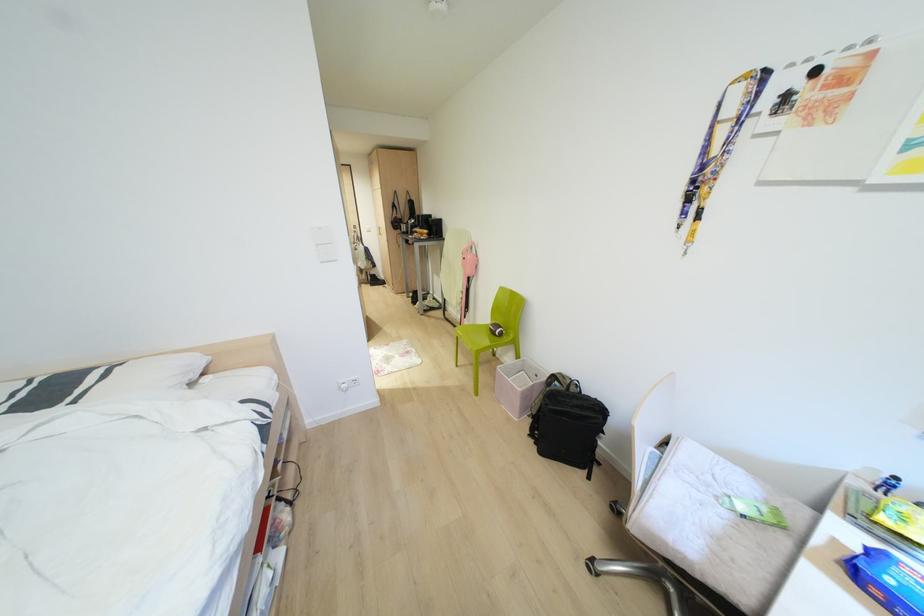
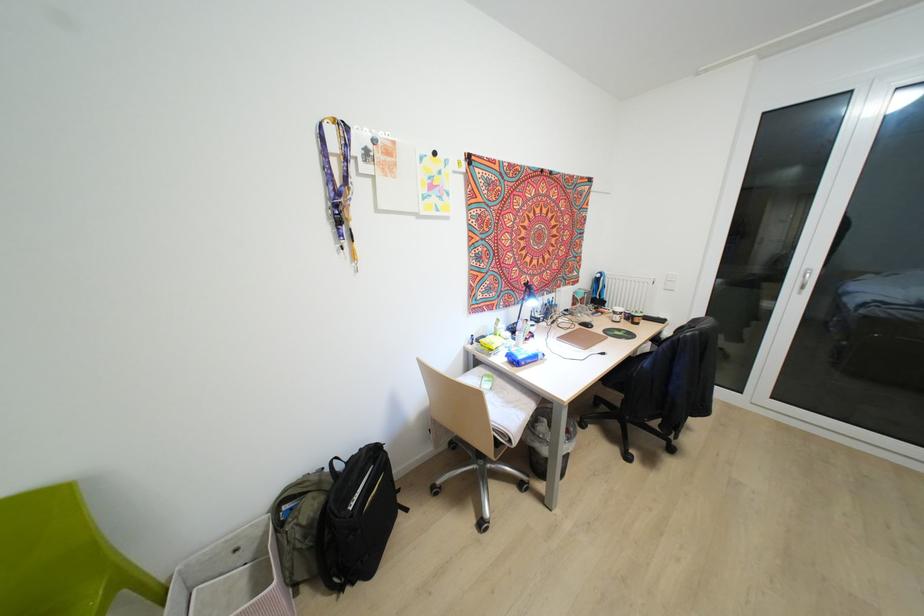
The point at (589,477) is marked in the first image. Where is the corresponding point in the second image?

(406, 509)